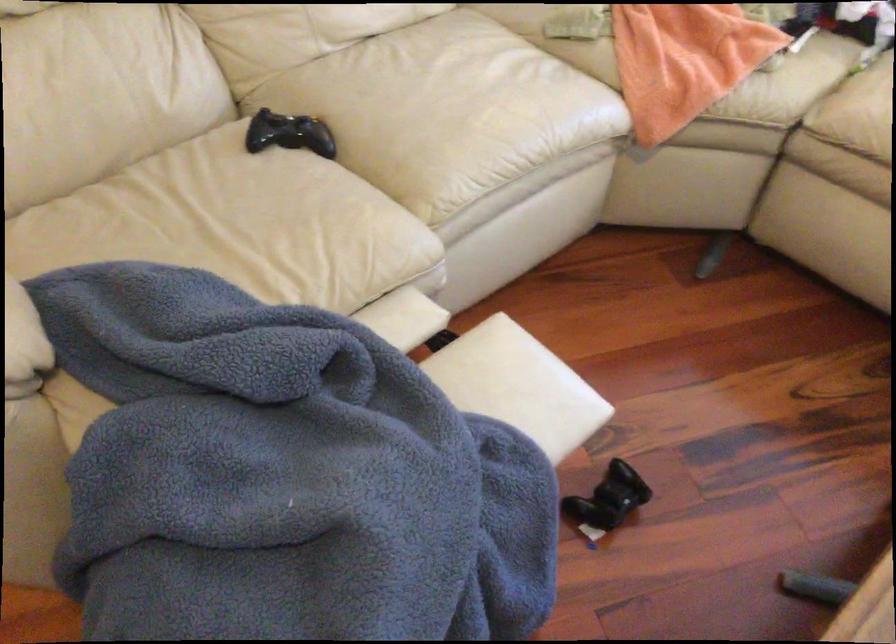
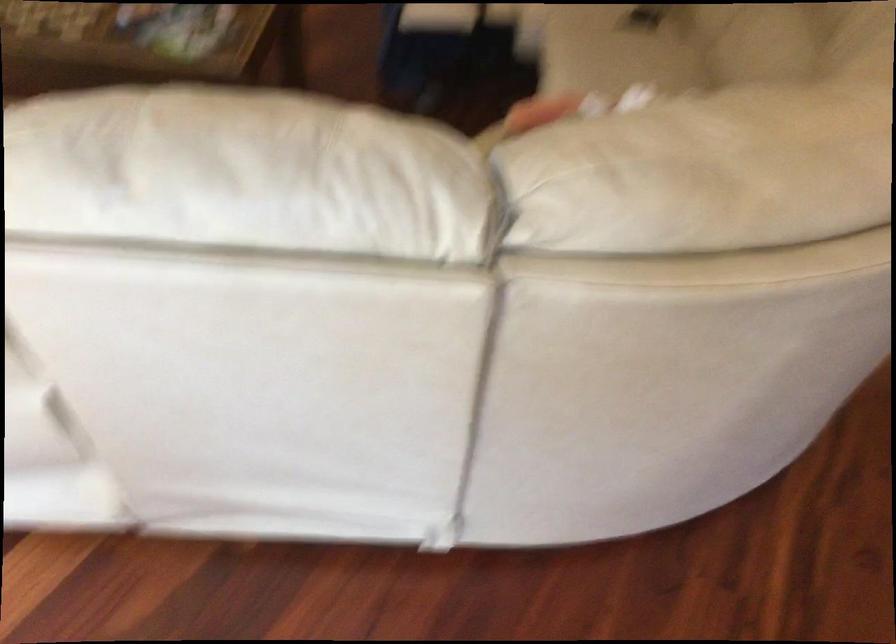
The point at (561, 359) is marked in the first image. Where is the corresponding point in the second image?

(437, 17)